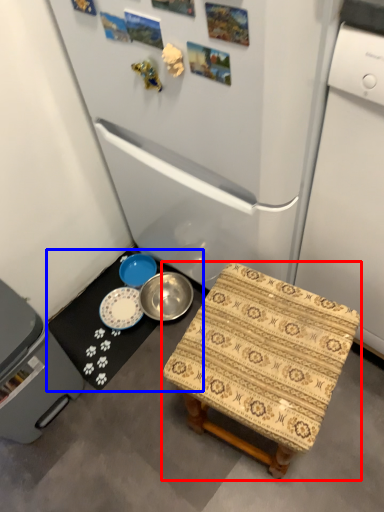
Question: Which object is closer to the camera taking this photo, furniture (highlighted by a red box) or table (highlighted by a blue box)?

Choices:
 (A) furniture
 (B) table

Answer: (A)